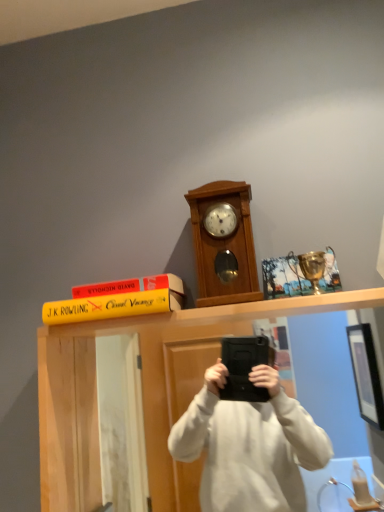
Question: Is wooden clock at center wider or thinner than yellow matte book at upper center?

Choices:
 (A) thin
 (B) wide

Answer: (A)

Question: Considering the relative positions of wooden clock at center and yellow matte book at upper center in the image provided, is wooden clock at center to the left or to the right of yellow matte book at upper center?

Choices:
 (A) right
 (B) left

Answer: (A)

Question: Based on their relative distances, which object is nearer to the yellow matte book at upper center?

Choices:
 (A) yellow matte book at upper center
 (B) wooden clock at center

Answer: (A)

Question: Estimate the real-world distances between objects in this image. Which object is farther from the wooden clock at center?

Choices:
 (A) yellow matte book at upper center
 (B) yellow matte book at upper center

Answer: (A)